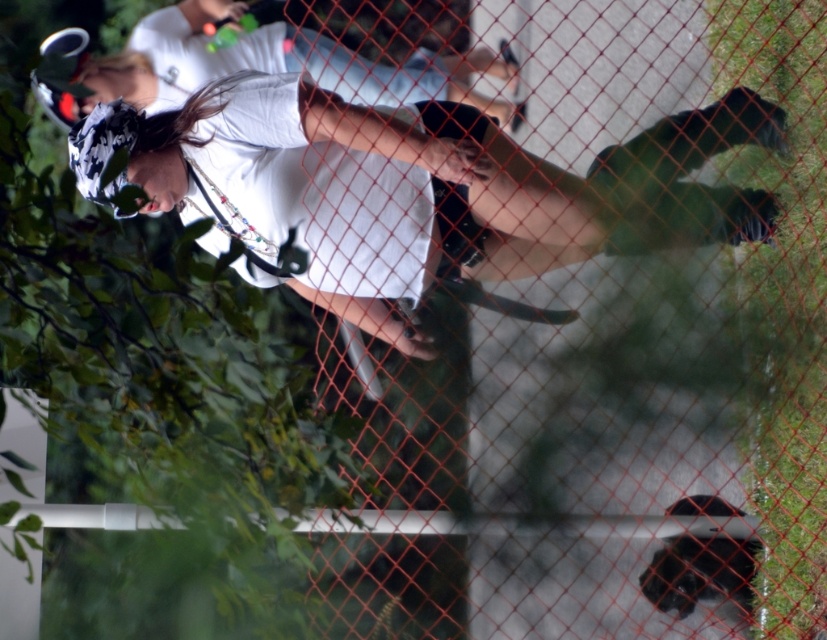
Question: Is white matte skateboard at center to the right of white matte shirt at center from the viewer's perspective?

Choices:
 (A) yes
 (B) no

Answer: (A)

Question: Which point is closer to the camera taking this photo?

Choices:
 (A) (183, 60)
 (B) (270, 212)

Answer: (B)

Question: Is white matte skateboard at center thinner than white matte shirt at center?

Choices:
 (A) yes
 (B) no

Answer: (B)

Question: Which point is closer to the camera taking this photo?

Choices:
 (A) (655, 164)
 (B) (276, 35)

Answer: (A)

Question: Can you confirm if white matte skateboard at center is smaller than white matte shirt at center?

Choices:
 (A) no
 (B) yes

Answer: (A)